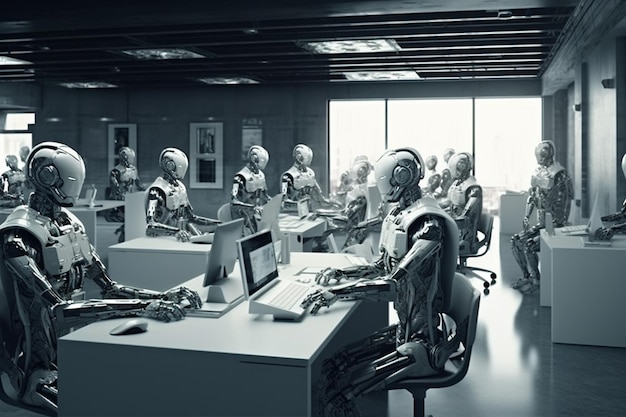
Locate an element on the screen. overhead lighting is located at coordinates (167, 52), (232, 79), (357, 45), (381, 74), (91, 75), (13, 61).